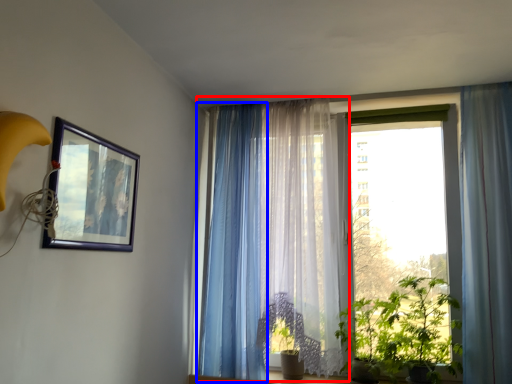
Question: Which of the following is the farthest to the observer, curtain (highlighted by a red box) or curtain (highlighted by a blue box)?

Choices:
 (A) curtain
 (B) curtain

Answer: (B)